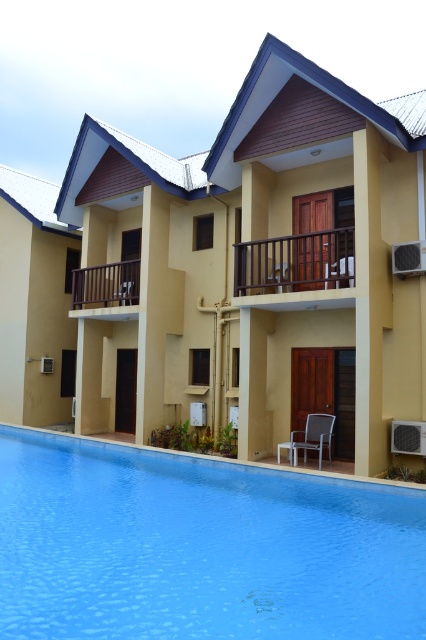
What do you see at coordinates (198, 548) in the screenshot? I see `blue smooth water at lower center` at bounding box center [198, 548].

Based on the photo, does blue smooth water at lower center have a lesser width compared to brown wooden railing at upper left?

Incorrect, blue smooth water at lower center's width is not less than brown wooden railing at upper left's.

Which is behind, point (321, 538) or point (71, 280)?

Point (71, 280)

I want to click on blue smooth water at lower center, so click(198, 548).

Does point (393, 189) come closer to viewer compared to point (296, 456)?

Yes.

Between yellow matte building at center and metallic gray chair at lower center, which one has more height?

yellow matte building at center is taller.

Which is in front, point (126, 400) or point (319, 420)?

Point (319, 420)

Find the location of `yellow matte building at center`. yellow matte building at center is located at coordinates (232, 273).

Is yellow matte building at center wider than brown wooden railing at upper center?

Yes, yellow matte building at center is wider than brown wooden railing at upper center.

Between point (6, 376) and point (353, 230), which one is positioned in front?

Point (353, 230) is in front.

Between point (157, 228) and point (350, 276), which one is positioned behind?

Positioned behind is point (157, 228).

The image size is (426, 640). I want to click on yellow matte building at center, so click(x=232, y=273).